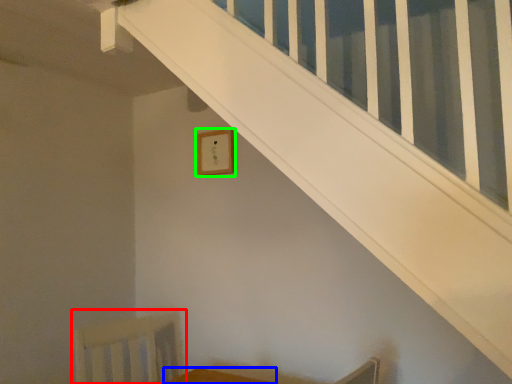
Question: Which object is positioned closest to swivel chair (highlighted by a red box)? Select from furniture (highlighted by a blue box) and picture frame (highlighted by a green box).

Choices:
 (A) furniture
 (B) picture frame

Answer: (A)